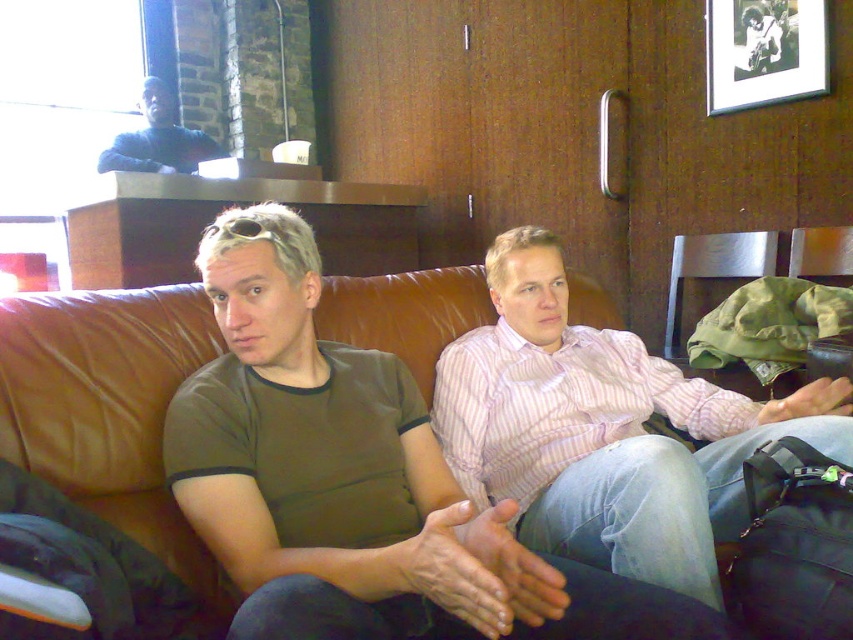
Is pink striped shirt at center positioned before brown leather couch at center?

Yes, pink striped shirt at center is in front of brown leather couch at center.

Who is positioned more to the right, pink striped shirt at center or brown leather couch at center?

pink striped shirt at center is more to the right.

The height and width of the screenshot is (640, 853). What do you see at coordinates (605, 429) in the screenshot? I see `pink striped shirt at center` at bounding box center [605, 429].

This screenshot has width=853, height=640. What are the coordinates of `pink striped shirt at center` in the screenshot? It's located at (605, 429).

Does brown leather couch at center appear on the left side of black matte picture frame at upper right?

Yes, brown leather couch at center is to the left of black matte picture frame at upper right.

Between point (61, 368) and point (798, 54), which one is positioned behind?

Point (798, 54)

Is point (334, 276) behind point (766, 32)?

That is False.

Where is `brown leather couch at center`? This screenshot has width=853, height=640. brown leather couch at center is located at coordinates (108, 406).

Is pink striped shirt at center to the left of dark blue sweater at upper left from the viewer's perspective?

In fact, pink striped shirt at center is to the right of dark blue sweater at upper left.

Can you confirm if pink striped shirt at center is taller than dark blue sweater at upper left?

Yes.

Measure the distance between pink striped shirt at center and camera.

38.05 inches

Locate an element on the screen. The height and width of the screenshot is (640, 853). pink striped shirt at center is located at coordinates (605, 429).